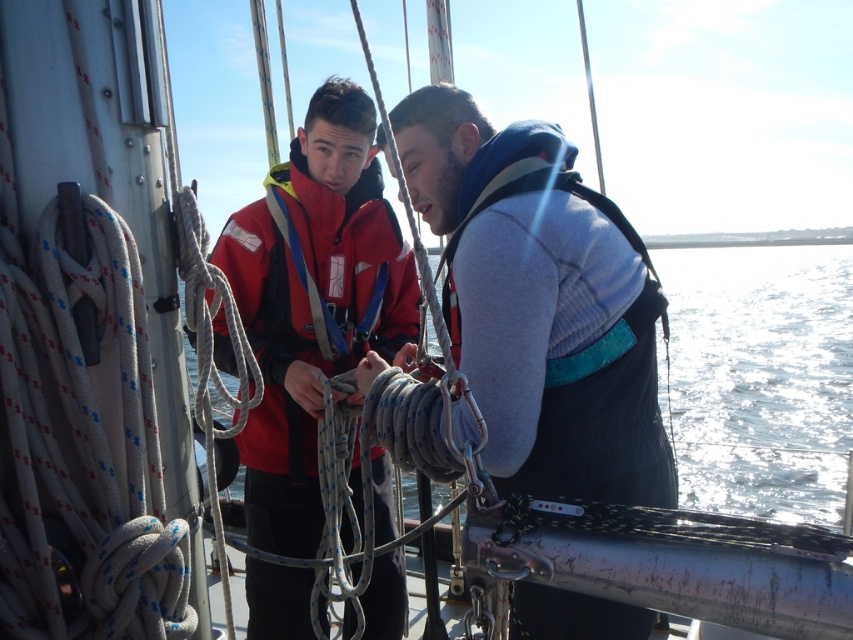
Between gray fleece sweater at center and matte red life jacket at center, which one appears on the right side from the viewer's perspective?

From the viewer's perspective, gray fleece sweater at center appears more on the right side.

Who is more distant from viewer, (456,232) or (397,248)?

The point (397,248) is more distant.

The height and width of the screenshot is (640, 853). I want to click on gray fleece sweater at center, so click(x=541, y=305).